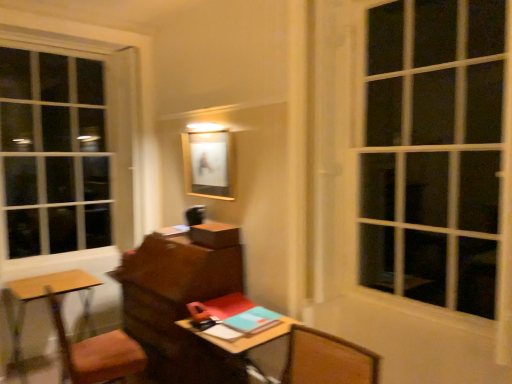
Question: Does wooden table at lower left have a lesser width compared to teal matte notebook at center?

Choices:
 (A) no
 (B) yes

Answer: (A)

Question: From the image's perspective, is wooden table at lower left located beneath teal matte notebook at center?

Choices:
 (A) yes
 (B) no

Answer: (A)

Question: Is wooden table at lower left to the right of teal matte notebook at center from the viewer's perspective?

Choices:
 (A) yes
 (B) no

Answer: (B)

Question: Is wooden table at lower left looking in the opposite direction of teal matte notebook at center?

Choices:
 (A) no
 (B) yes

Answer: (A)

Question: From a real-world perspective, is wooden table at lower left physically above teal matte notebook at center?

Choices:
 (A) no
 (B) yes

Answer: (A)

Question: From their relative heights in the image, would you say matte wooden picture frame at center is taller or shorter than wooden table at lower left?

Choices:
 (A) short
 (B) tall

Answer: (A)

Question: Looking at the image, does matte wooden picture frame at center seem bigger or smaller compared to wooden table at lower left?

Choices:
 (A) big
 (B) small

Answer: (B)

Question: From the image's perspective, is matte wooden picture frame at center located above or below wooden table at lower left?

Choices:
 (A) above
 (B) below

Answer: (A)

Question: Considering the relative positions of matte wooden picture frame at center and wooden table at lower left in the image provided, is matte wooden picture frame at center to the left or to the right of wooden table at lower left?

Choices:
 (A) right
 (B) left

Answer: (A)

Question: Considering the positions of matte wooden picture frame at center and teal matte notebook at center in the image, is matte wooden picture frame at center wider or thinner than teal matte notebook at center?

Choices:
 (A) thin
 (B) wide

Answer: (A)

Question: Do you think matte wooden picture frame at center is within teal matte notebook at center, or outside of it?

Choices:
 (A) outside
 (B) inside

Answer: (A)

Question: Is point (230, 140) closer or farther from the camera than point (270, 326)?

Choices:
 (A) farther
 (B) closer

Answer: (A)

Question: Is matte wooden picture frame at center bigger or smaller than teal matte notebook at center?

Choices:
 (A) big
 (B) small

Answer: (A)

Question: From the image's perspective, is wooden desk at center located above or below teal matte notebook at center?

Choices:
 (A) above
 (B) below

Answer: (B)

Question: In terms of size, does wooden desk at center appear bigger or smaller than teal matte notebook at center?

Choices:
 (A) small
 (B) big

Answer: (B)